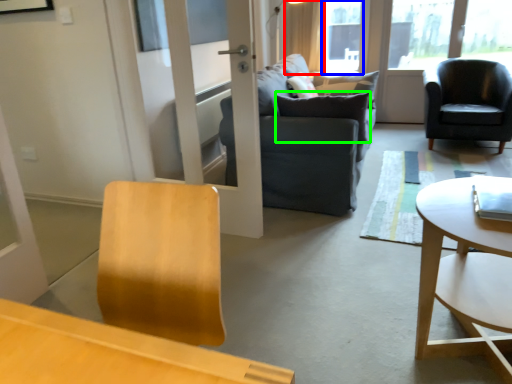
Question: Which object is positioned farthest from curtain (highlighted by a red box)? Select from window screen (highlighted by a blue box) and pillow (highlighted by a green box).

Choices:
 (A) window screen
 (B) pillow

Answer: (B)